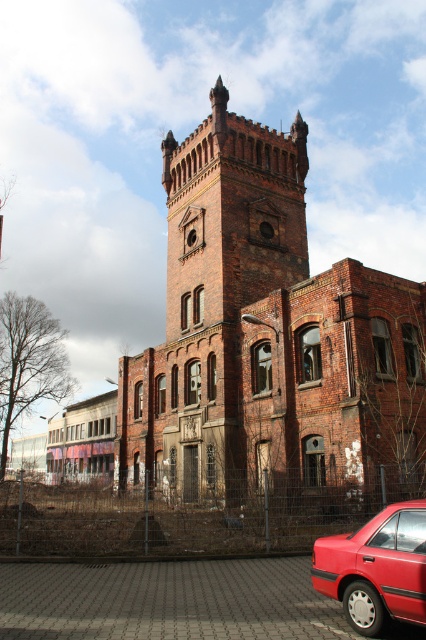
Is brown brick tower at center above shiny red sedan at lower right?

Correct, brown brick tower at center is located above shiny red sedan at lower right.

Does point (184, 150) come in front of point (345, 550)?

No, it is not.

This screenshot has width=426, height=640. I want to click on brown brick tower at center, so click(x=215, y=305).

Who is higher up, rustic brick bell tower at center or shiny red sedan at lower right?

rustic brick bell tower at center

Does rustic brick bell tower at center appear under shiny red sedan at lower right?

Incorrect, rustic brick bell tower at center is not positioned below shiny red sedan at lower right.

At what (x,y) coordinates should I click in order to perform the action: click on rustic brick bell tower at center. Please return your answer as a coordinate pair (x, y). Looking at the image, I should click on (232, 214).

Is brown brick tower at center wider than rustic brick bell tower at center?

Yes.

Can you confirm if brown brick tower at center is positioned to the right of rustic brick bell tower at center?

Correct, you'll find brown brick tower at center to the right of rustic brick bell tower at center.

What do you see at coordinates (215, 305) in the screenshot? The image size is (426, 640). I see `brown brick tower at center` at bounding box center [215, 305].

This screenshot has width=426, height=640. What are the coordinates of `brown brick tower at center` in the screenshot? It's located at (215, 305).